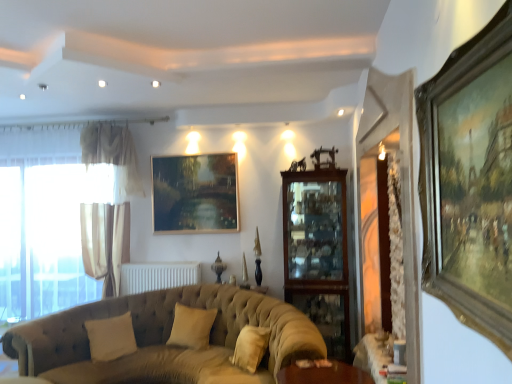
Describe the element at coordinates (165, 339) in the screenshot. I see `tufted fabric couch at lower left` at that location.

This screenshot has width=512, height=384. Describe the element at coordinates (47, 233) in the screenshot. I see `white sheer curtains at left` at that location.

You are a GUI agent. You are given a task and a screenshot of the screen. Output one action in this format:
    pyautogui.click(x=<x>, y=<y>)
    Task: Click on the white matte radiator at center
    Image resolution: width=512 pixels, height=384 pixels.
    Given the screenshot: What is the action you would take?
    pyautogui.click(x=158, y=276)

What do you see at coordinates (158, 276) in the screenshot?
I see `white matte radiator at center` at bounding box center [158, 276].

The image size is (512, 384). Identify the location of beige fabric pillow at lower left, which appears as the 1th pillow when viewed from the left. (111, 337).

Image resolution: width=512 pixels, height=384 pixels. In order to click on oil painting at center, the 2th picture frame in the right-to-left sequence in this screenshot , I will do `click(195, 193)`.

Identify the location of beige fabric pillow at center, which appears as the first pillow when viewed from the right. (191, 327).

This screenshot has width=512, height=384. What do you see at coordinates (191, 327) in the screenshot?
I see `beige fabric pillow at center, which appears as the first pillow when viewed from the right` at bounding box center [191, 327].

This screenshot has height=384, width=512. What are the coordinates of `tufted fabric couch at lower left` in the screenshot? It's located at (165, 339).

How different are the orientations of wooden table at lower right and white sheer curtains at left in degrees?

There is a 93.3-degree angle between the facing directions of wooden table at lower right and white sheer curtains at left.

Is wooden table at lower right facing away from white sheer curtains at left?

That's not correct — wooden table at lower right is not looking away from white sheer curtains at left.

Based on their positions, is wooden table at lower right located to the left or right of white sheer curtains at left?

Clearly, wooden table at lower right is on the right of white sheer curtains at left in the image.

Which object is wider, wooden table at lower right or white sheer curtains at left?

wooden table at lower right is wider.

How different are the orientations of wooden table at lower right and oil painting at center, arranged as the first picture frame when viewed from the back, in degrees?

93.3 degrees separate the facing orientations of wooden table at lower right and oil painting at center, arranged as the first picture frame when viewed from the back.

Between wooden table at lower right and oil painting at center, the 2th picture frame in the right-to-left sequence, which one is positioned behind?

oil painting at center, the 2th picture frame in the right-to-left sequence, is more distant.

Does wooden table at lower right touch oil painting at center, the second picture frame when ordered from front to back?

No, wooden table at lower right is not beside oil painting at center, the second picture frame when ordered from front to back.

From the image's perspective, does wooden table at lower right appear lower than oil painting at center, the 2th picture frame in the right-to-left sequence?

Yes, from the image's perspective, wooden table at lower right is below oil painting at center, the 2th picture frame in the right-to-left sequence.

Is gold-toned wooden picture frame at right, which appears as the 1th picture frame when viewed from the front, inside white matte radiator at center?

No, gold-toned wooden picture frame at right, which appears as the 1th picture frame when viewed from the front, is located outside of white matte radiator at center.

Is white matte radiator at center not near gold-toned wooden picture frame at right, acting as the 1th picture frame starting from the right?

Yes.

In the scene shown: Is white matte radiator at center further to camera compared to gold-toned wooden picture frame at right, which appears as the 1th picture frame when viewed from the front?

Yes, it is.

Is white sheer curtains at left next to beige fabric pillow at center, the 2th pillow from the left, and touching it?

No, white sheer curtains at left is not next to beige fabric pillow at center, the 2th pillow from the left.

From the image's perspective, is white sheer curtains at left above or below beige fabric pillow at center, the 2th pillow from the left?

Clearly, from the image's perspective, white sheer curtains at left is above beige fabric pillow at center, the 2th pillow from the left.

Which of these two, white sheer curtains at left or beige fabric pillow at center, the 2th pillow from the left, stands taller?

Standing taller between the two is white sheer curtains at left.

Considering the positions of objects white sheer curtains at left and beige fabric pillow at center, which appears as the first pillow when viewed from the right, in the image provided, who is behind, white sheer curtains at left or beige fabric pillow at center, which appears as the first pillow when viewed from the right,?

white sheer curtains at left is further from the camera.

Is beige fabric pillow at lower left, which appears as the 1th pillow when viewed from the left, shorter than oil painting at center, arranged as the first picture frame when viewed from the back?

Yes, beige fabric pillow at lower left, which appears as the 1th pillow when viewed from the left, is shorter than oil painting at center, arranged as the first picture frame when viewed from the back.

Considering their positions, is beige fabric pillow at lower left, the 2th pillow positioned from the right, located in front of or behind oil painting at center, the 2th picture frame in the right-to-left sequence?

Visually, beige fabric pillow at lower left, the 2th pillow positioned from the right, is located in front of oil painting at center, the 2th picture frame in the right-to-left sequence.

Considering the relative positions of beige fabric pillow at lower left, which appears as the 1th pillow when viewed from the left, and oil painting at center, arranged as the first picture frame when viewed from the back, in the image provided, is beige fabric pillow at lower left, which appears as the 1th pillow when viewed from the left, to the right of oil painting at center, arranged as the first picture frame when viewed from the back, from the viewer's perspective?

No.

Does point (131, 320) come behind point (188, 229)?

No, it is not.

Is oil painting at center, arranged as the 1th picture frame when viewed from the left, oriented away from gold-toned wooden picture frame at right, the 2th picture frame from the left?

No.

Can you tell me how much oil painting at center, the second picture frame when ordered from front to back, and gold-toned wooden picture frame at right, which appears as the 1th picture frame when viewed from the front, differ in facing direction?

oil painting at center, the second picture frame when ordered from front to back, and gold-toned wooden picture frame at right, which appears as the 1th picture frame when viewed from the front, are facing 89.7 degrees away from each other.

Considering the points (170, 199) and (423, 196), which point is in front, point (170, 199) or point (423, 196)?

The point (423, 196) is more forward.

Find the location of `picture frame that is below the gold-toned wooden picture frame at right, the 2th picture frame from the left (from the image's perspective)`. picture frame that is below the gold-toned wooden picture frame at right, the 2th picture frame from the left (from the image's perspective) is located at coordinates (195, 193).

Which of these two, beige fabric pillow at center, the 2th pillow from the left, or white sheer curtains at left, stands taller?

white sheer curtains at left is taller.

Is beige fabric pillow at center, which appears as the first pillow when viewed from the right, wider or thinner than white sheer curtains at left?

beige fabric pillow at center, which appears as the first pillow when viewed from the right, is wider than white sheer curtains at left.

From a real-world perspective, who is located higher, beige fabric pillow at center, the 2th pillow from the left, or white sheer curtains at left?

white sheer curtains at left, from a real-world perspective.

You are a GUI agent. You are given a task and a screenshot of the screen. Output one action in this format:
    pyautogui.click(x=<x>, y=<y>)
    Task: Click on the window that is on the left side of wooden table at lower right
    
    Given the screenshot: What is the action you would take?
    pyautogui.click(x=47, y=233)

At what (x,y) coordinates should I click in order to perform the action: click on table in front of the oil painting at center, arranged as the 1th picture frame when viewed from the left. Please return your answer as a coordinate pair (x, y). The image size is (512, 384). Looking at the image, I should click on pos(371,357).

Considering their positions, is beige fabric pillow at center, the 2th pillow from the left, positioned closer to beige fabric curtain at left than wooden table at lower right?

The object closer to beige fabric curtain at left is beige fabric pillow at center, the 2th pillow from the left.

From the picture: Considering their positions, is beige fabric pillow at lower left, the 2th pillow positioned from the right, positioned closer to white sheer curtains at left than tufted fabric couch at lower left?

beige fabric pillow at lower left, the 2th pillow positioned from the right, is positioned closer to the anchor white sheer curtains at left.

Considering their positions, is beige fabric curtain at left positioned closer to white matte radiator at center than beige fabric pillow at center, the 2th pillow from the left?

The object closer to white matte radiator at center is beige fabric curtain at left.

Considering their positions, is wooden table at lower right positioned closer to white sheer curtains at left than oil painting at center, the second picture frame when ordered from front to back?

oil painting at center, the second picture frame when ordered from front to back.

Based on their spatial positions, is oil painting at center, the second picture frame when ordered from front to back, or white sheer curtains at left further from gold-toned wooden picture frame at right, acting as the 1th picture frame starting from the right?

white sheer curtains at left lies further to gold-toned wooden picture frame at right, acting as the 1th picture frame starting from the right, than the other object.

Considering their positions, is white matte radiator at center positioned further to tufted fabric couch at lower left than wooden table at lower right?

wooden table at lower right.

Which object lies further to the anchor point white sheer curtains at left, tufted fabric couch at lower left or wooden table at lower right?

wooden table at lower right is positioned further to the anchor white sheer curtains at left.

Looking at the image, which one is located closer to beige fabric pillow at center, which appears as the first pillow when viewed from the right, white matte radiator at center or tufted fabric couch at lower left?

tufted fabric couch at lower left lies closer to beige fabric pillow at center, which appears as the first pillow when viewed from the right, than the other object.

The image size is (512, 384). In order to click on window between beige fabric curtain at left and beige fabric pillow at lower left, which appears as the 1th pillow when viewed from the left, in the vertical direction in this screenshot , I will do `click(47, 233)`.

This screenshot has height=384, width=512. In order to click on radiator that lies between beige fabric curtain at left and beige fabric pillow at lower left, the 2th pillow positioned from the right, from top to bottom in this screenshot , I will do `click(158, 276)`.

Locate an element on the screen. The image size is (512, 384). table between gold-toned wooden picture frame at right, the 2th picture frame from the left, and white sheer curtains at left in the front-back direction is located at coordinates (371, 357).

Identify the location of pillow between white sheer curtains at left and beige fabric pillow at center, the 2th pillow from the left, in the horizontal direction. (111, 337).